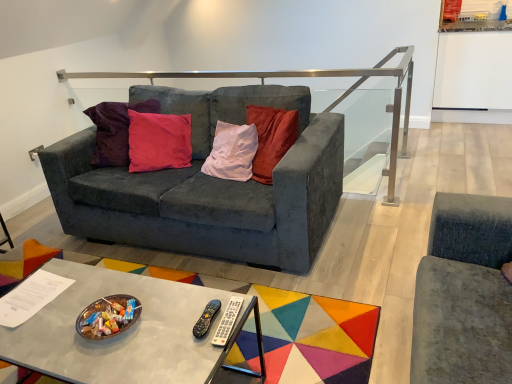
At what (x,y) coordinates should I click in order to perform the action: click on unoccupied space behind black plastic remote at center, which is the 1th remote from left to right. Please return your answer as a coordinate pair (x, y). This screenshot has width=512, height=384. Looking at the image, I should click on (192, 296).